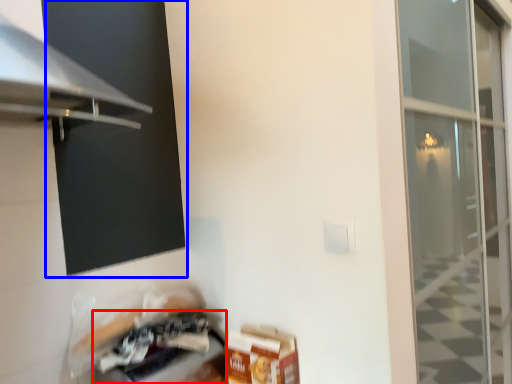
Question: Which point is further to the camera, appliance (highlighted by a red box) or window screen (highlighted by a blue box)?

Choices:
 (A) appliance
 (B) window screen

Answer: (A)